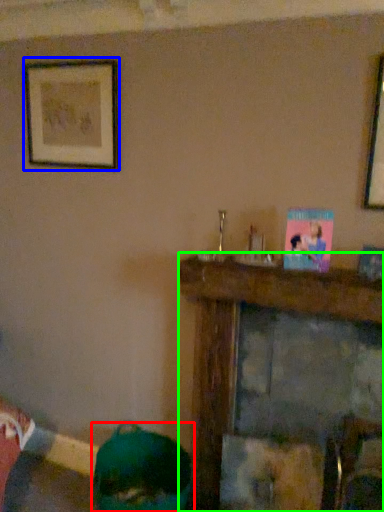
Question: Which object is positioned farthest from person (highlighted by a red box)? Select from picture frame (highlighted by a blue box) and furniture (highlighted by a green box).

Choices:
 (A) picture frame
 (B) furniture

Answer: (A)